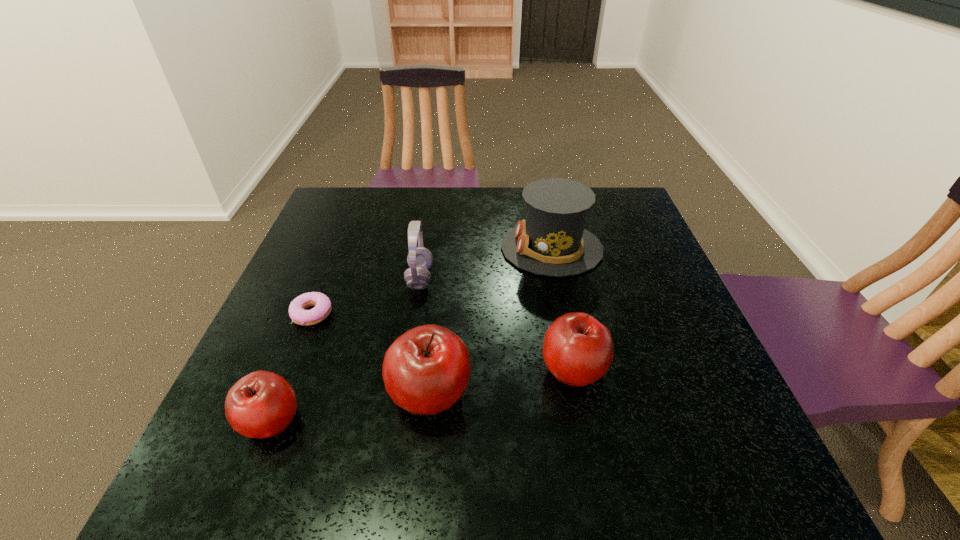
Please point a spot on the right to add another apple. Please provide its 2D coordinates. Your answer should be formatted as a tuple, i.e. [(x, y)], where the tuple contains the x and y coordinates of a point satisfying the conditions above.

[(703, 347)]